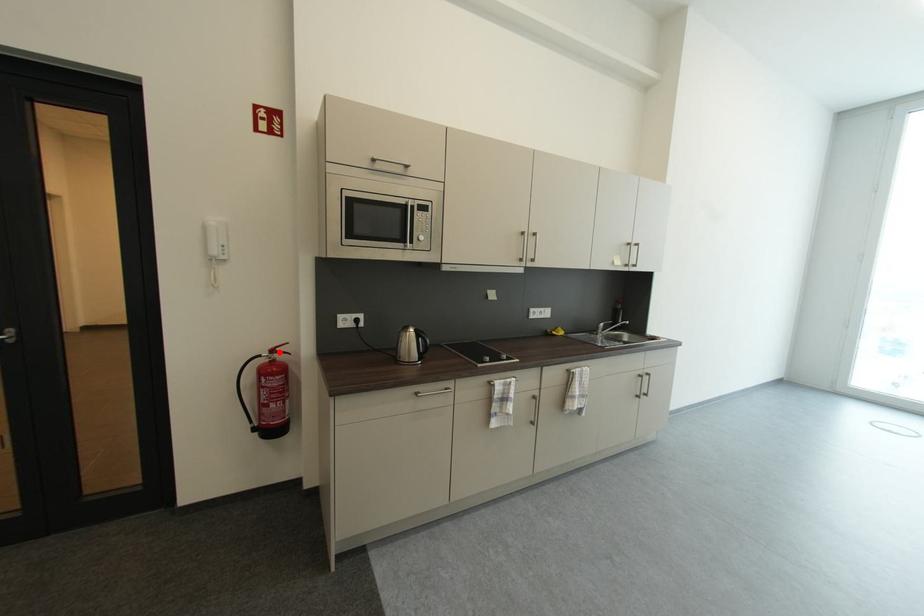
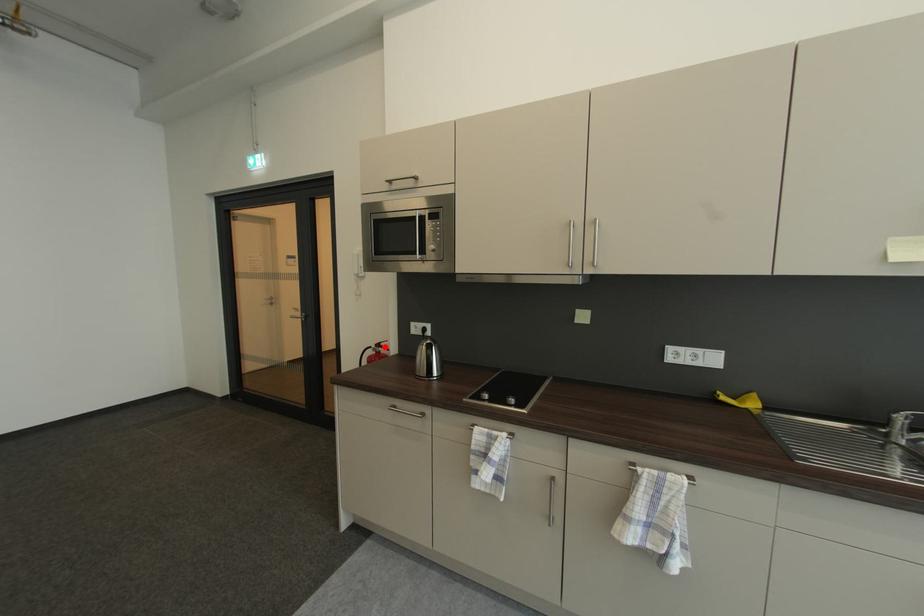
I am providing you with two images of the same scene from different viewpoints. A red point is marked on the first image and another point is marked on the second image. Is the red point in image1 aligned with the point shown in image2?

Yes